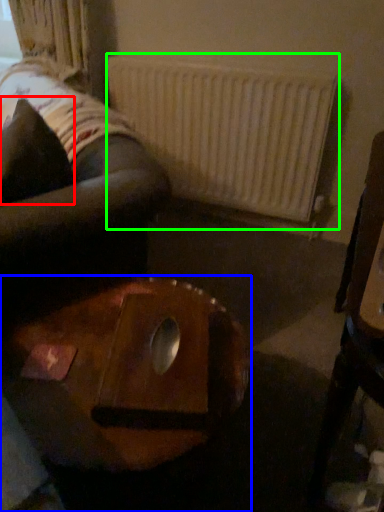
Question: Which object is the closest to the pillow (highlighted by a red box)? Choose among these: table (highlighted by a blue box) or radiator (highlighted by a green box).

Choices:
 (A) table
 (B) radiator

Answer: (A)